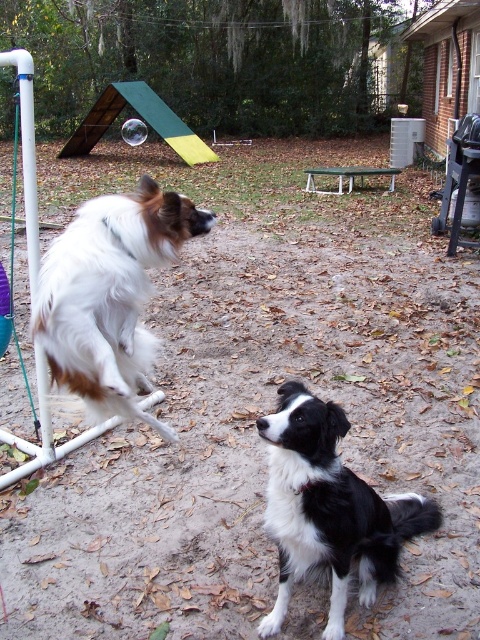
Question: Which object appears farthest from the camera in this image?

Choices:
 (A) black and white fur at center
 (B) white and brown fur dog at left

Answer: (B)

Question: Can you confirm if white and brown fur dog at left is positioned below black and white fur at center?

Choices:
 (A) yes
 (B) no

Answer: (B)

Question: Is white and brown fur dog at left above black and white fur at center?

Choices:
 (A) yes
 (B) no

Answer: (A)

Question: Does white and brown fur dog at left appear on the left side of black and white fur at center?

Choices:
 (A) no
 (B) yes

Answer: (B)